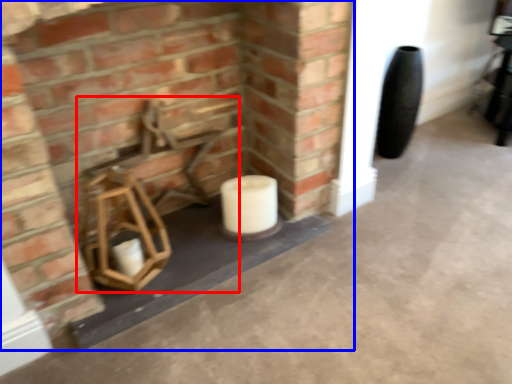
Question: Which point is further to the camera, chair (highlighted by a red box) or fireplace (highlighted by a blue box)?

Choices:
 (A) chair
 (B) fireplace

Answer: (A)